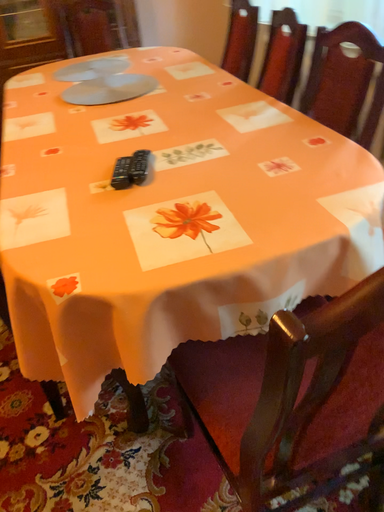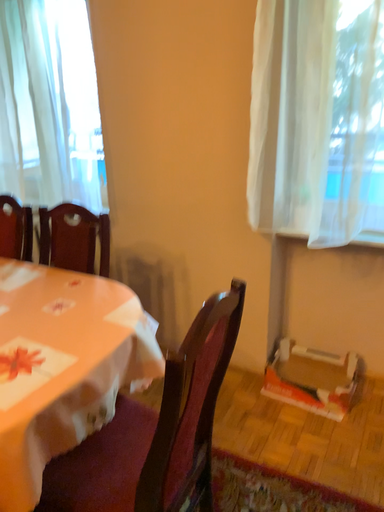
Question: Which way did the camera rotate in the video?

Choices:
 (A) rotated right
 (B) rotated left

Answer: (A)